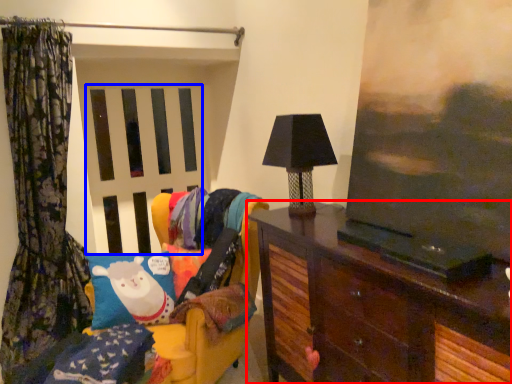
Question: Which point is closer to the camera, furniture (highlighted by a red box) or screen door (highlighted by a blue box)?

Choices:
 (A) furniture
 (B) screen door

Answer: (A)